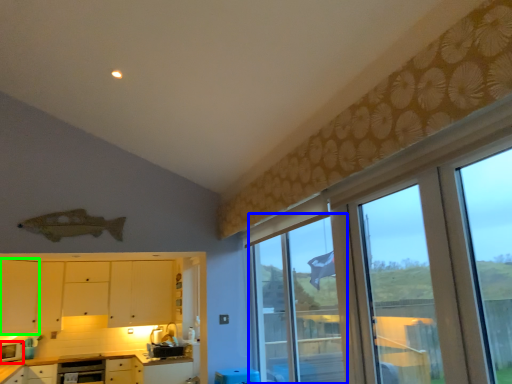
Question: Considering the real-world distances, which object is closest to appliance (highlighted by a red box)? window (highlighted by a blue box) or cabinetry (highlighted by a green box).

Choices:
 (A) window
 (B) cabinetry

Answer: (B)